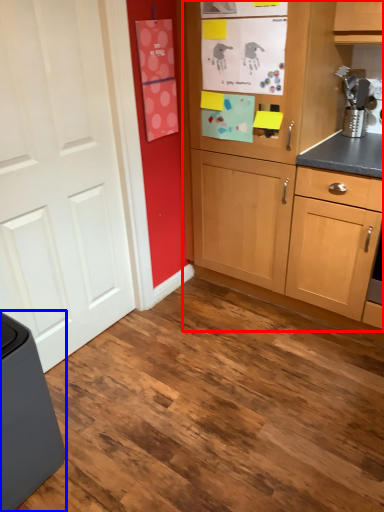
Question: Which of the following is the farthest to the observer, cabinetry (highlighted by a red box) or home appliance (highlighted by a blue box)?

Choices:
 (A) cabinetry
 (B) home appliance

Answer: (A)